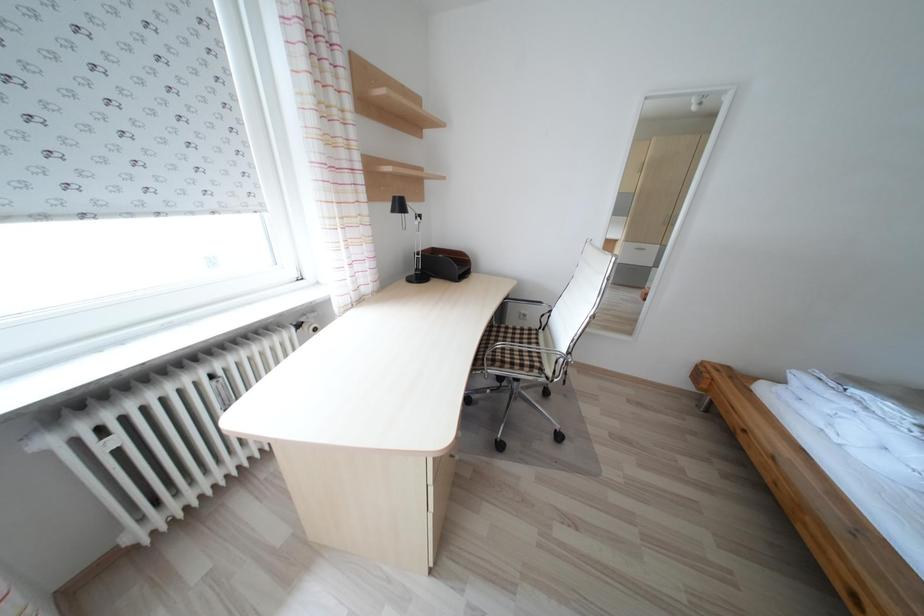
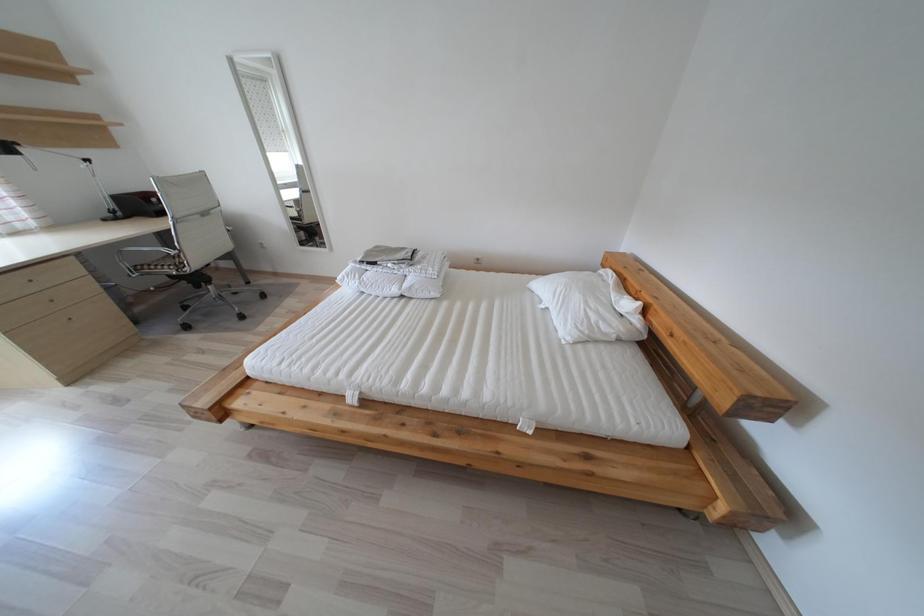
In a continuous first-person perspective shot, in which direction is the camera moving?

The cameraman walked toward right, backward.